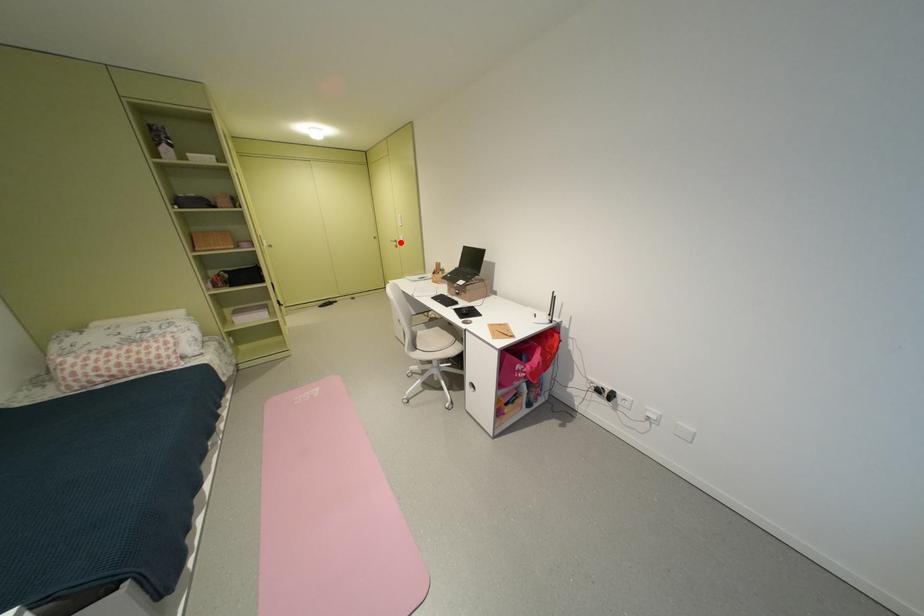
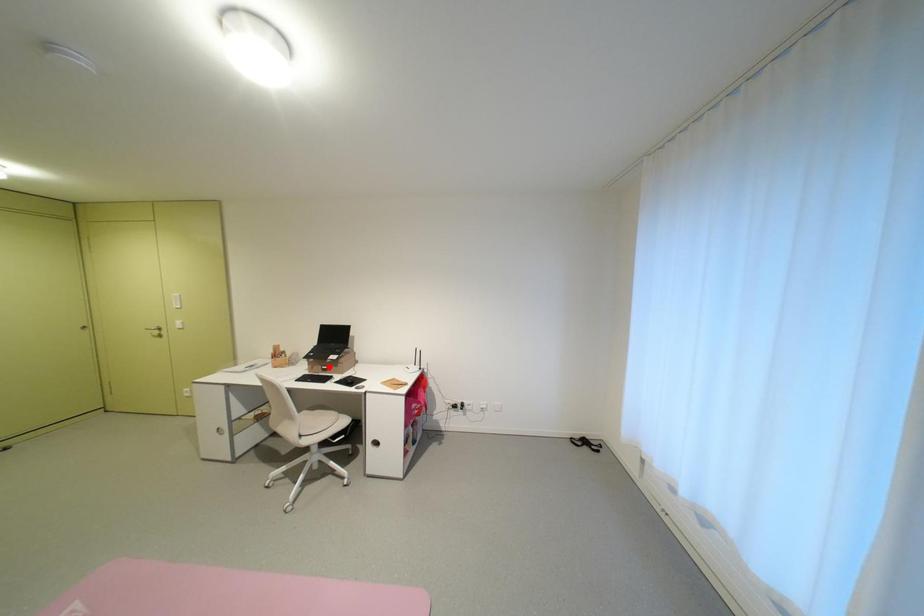
I am providing you with two images of the same scene from different viewpoints. A red point is marked on the first image and another point is marked on the second image. Does the point marked in image1 correspond to the same location as the one in image2?

No